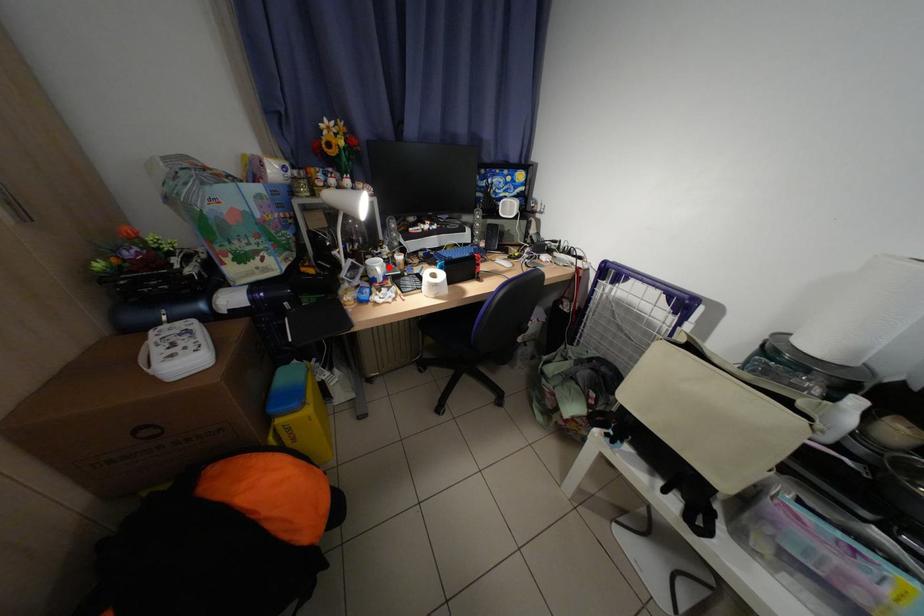
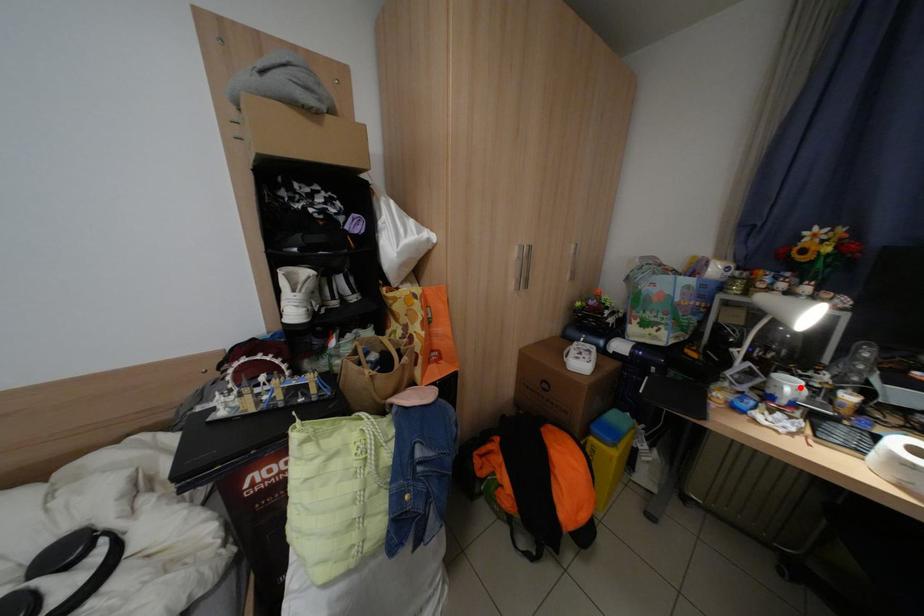
I am providing you with two images of the same scene from different viewpoints. A red point is marked on the first image and another point is marked on the second image. Do the highlighted points in image1 and image2 indicate the same real-world spot?

Yes